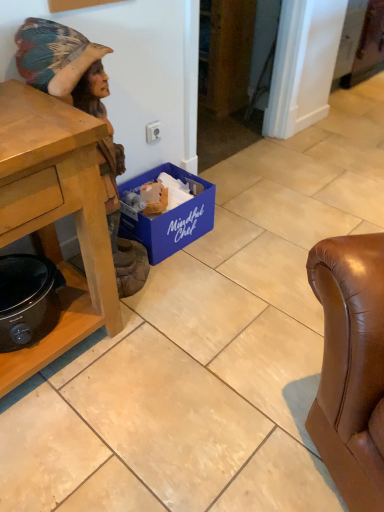
Question: Would you say wooden statue at left is inside or outside blue cardboard box at lower center?

Choices:
 (A) outside
 (B) inside

Answer: (A)

Question: From the image's perspective, relative to blue cardboard box at lower center, is wooden statue at left above or below?

Choices:
 (A) above
 (B) below

Answer: (A)

Question: Which object is the closest to the blue cardboard box at lower center?

Choices:
 (A) black matte slow cooker at lower left
 (B) wooden statue at left

Answer: (B)

Question: Based on their relative distances, which object is farther from the black matte slow cooker at lower left?

Choices:
 (A) blue cardboard box at lower center
 (B) wooden statue at left

Answer: (A)